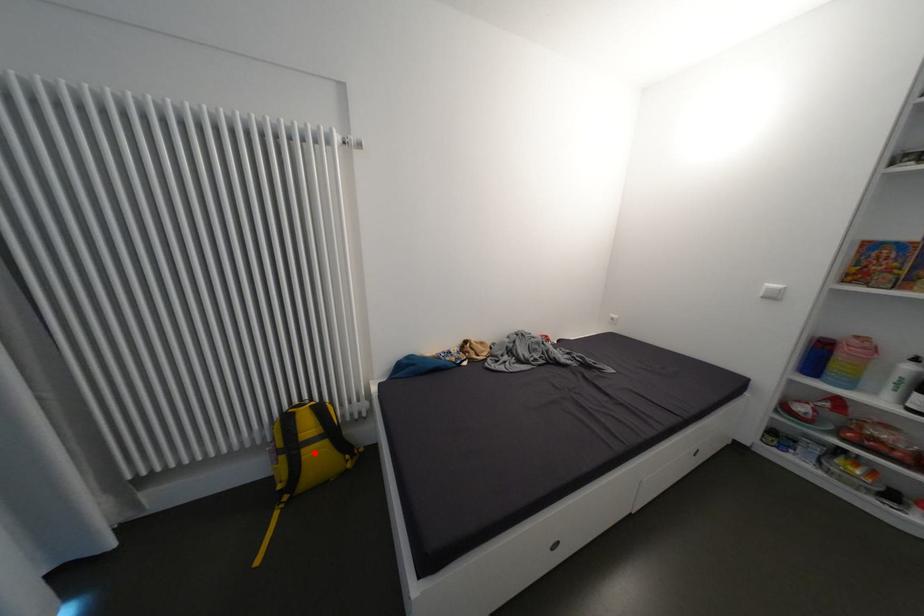
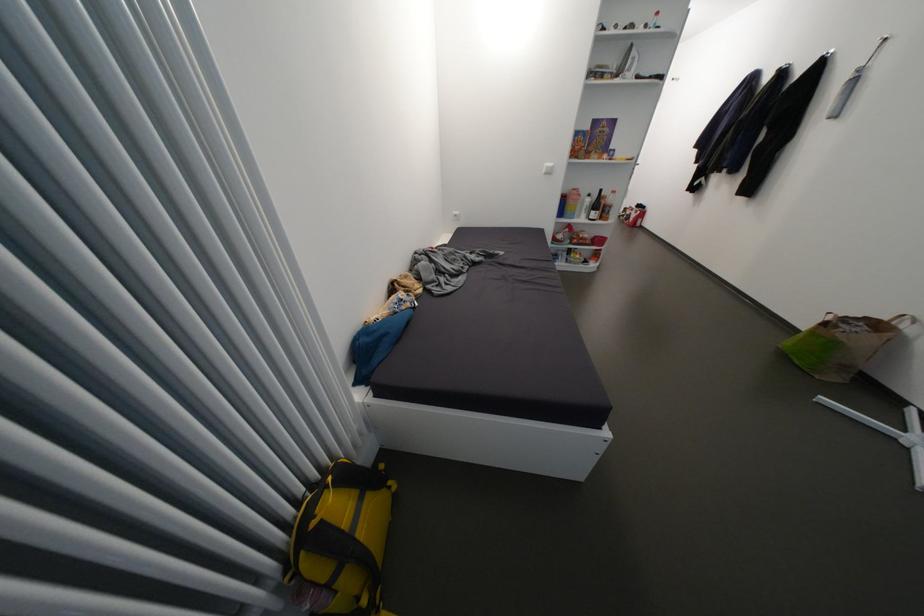
Question: A red point is marked in image1. In image2, is the corresponding 3D point closer to the camera or farther? Reply with the corresponding letter.

Choices:
 (A) The corresponding 3D point is closer.
 (B) The corresponding 3D point is farther.

Answer: (A)